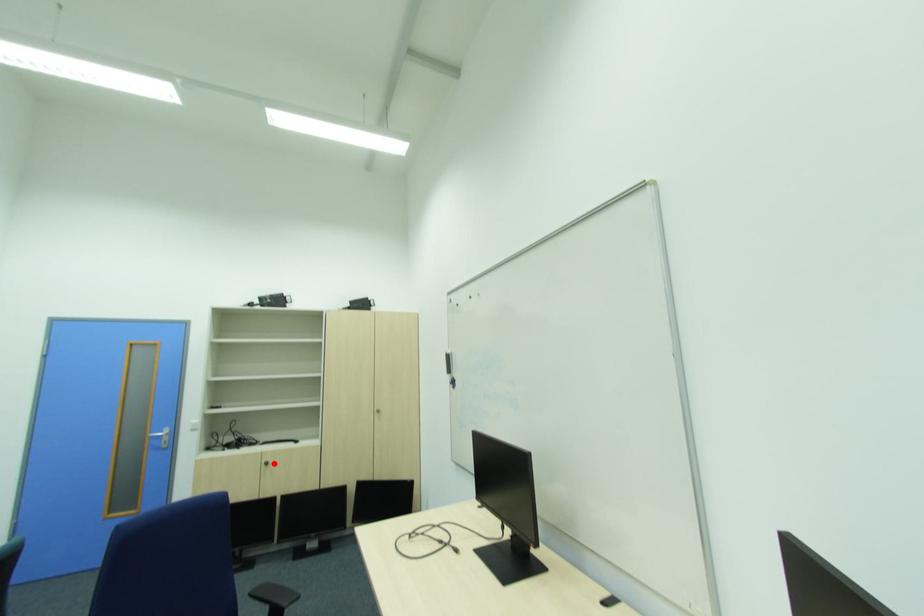
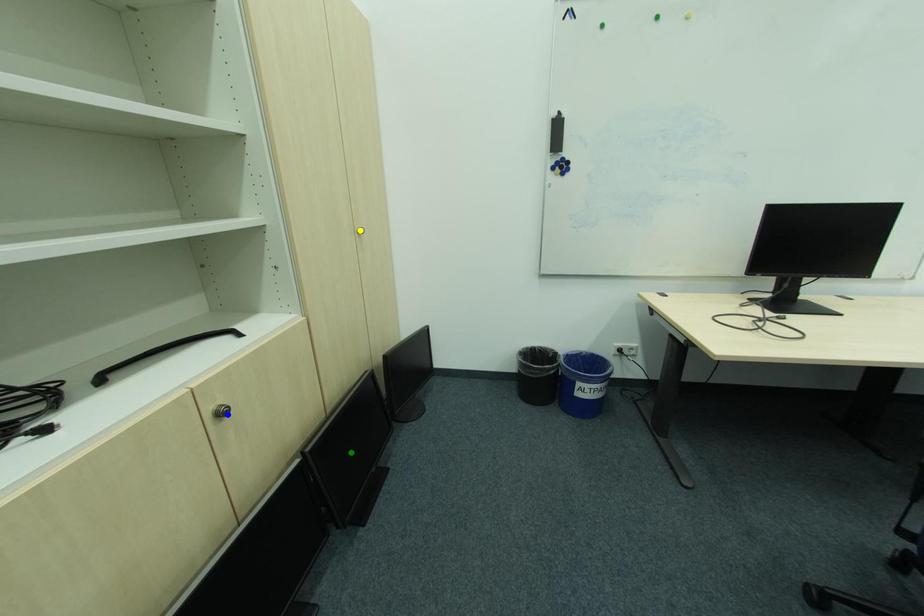
Question: I am providing you with two images of the same scene from different viewpoints. A red point is marked on the first image. You are given multiple points on the second image. Can you choose the point in image 2 that corresponds to the point in image 1?

Choices:
 (A) blue point
 (B) green point
 (C) yellow point

Answer: (A)